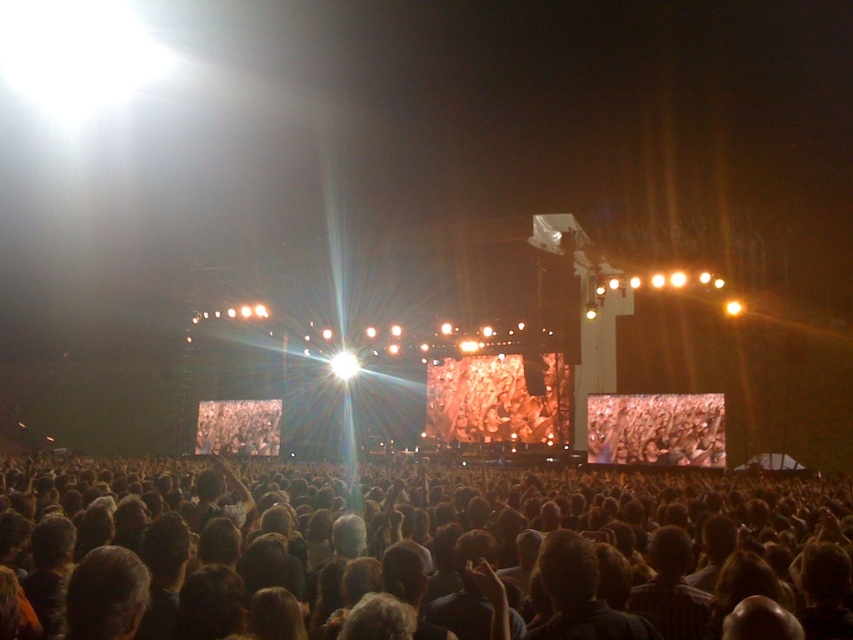
Who is higher up, dark brown hair at center or matte black crowd at center?

Positioned higher is matte black crowd at center.

Between point (82, 502) and point (636, 406), which one is positioned behind?

Point (636, 406)

At what (x,y) coordinates should I click in order to perform the action: click on dark brown hair at center. Please return your answer as a coordinate pair (x, y). The image size is (853, 640). Looking at the image, I should click on (415, 556).